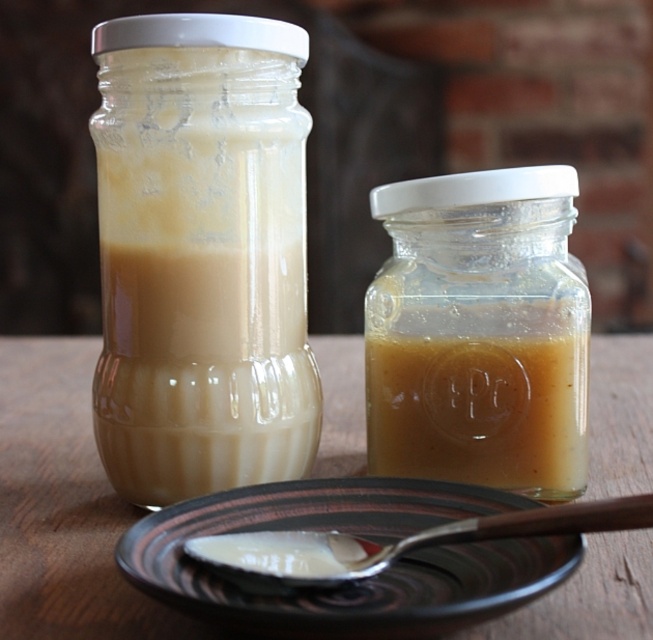
Between point (236, 621) and point (456, 520), which one is positioned in front?

Positioned in front is point (236, 621).

This screenshot has width=653, height=640. Describe the element at coordinates (358, 580) in the screenshot. I see `matte ceramic plate at lower center` at that location.

I want to click on matte ceramic plate at lower center, so click(x=358, y=580).

Can you confirm if translucent glass jar at left is taller than matte ceramic plate at lower center?

Yes.

Consider the image. Is translucent glass jar at left smaller than matte ceramic plate at lower center?

Actually, translucent glass jar at left might be larger than matte ceramic plate at lower center.

At what (x,y) coordinates should I click in order to perform the action: click on translucent glass jar at left. Please return your answer as a coordinate pair (x, y). The height and width of the screenshot is (640, 653). Looking at the image, I should click on (200, 256).

Where is `translucent glass jar at left`? This screenshot has height=640, width=653. translucent glass jar at left is located at coordinates (200, 256).

Who is positioned more to the left, translucent glass jar at left or wooden table at center?

Positioned to the left is translucent glass jar at left.

Is point (136, 428) more distant than point (59, 624)?

Yes.

The width and height of the screenshot is (653, 640). What are the coordinates of `translucent glass jar at left` in the screenshot? It's located at (200, 256).